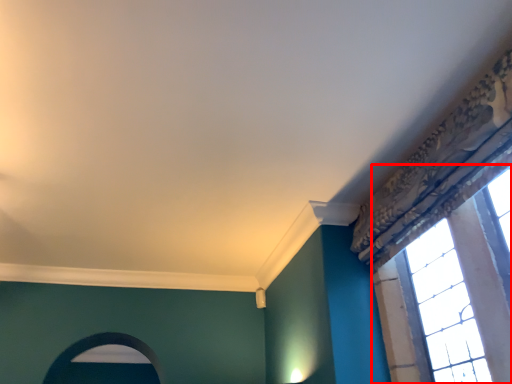
Question: From the image's perspective, considering the relative positions of window (annotated by the red box) and archway in the image provided, where is window (annotated by the red box) located with respect to the staircase?

Choices:
 (A) below
 (B) above

Answer: (B)